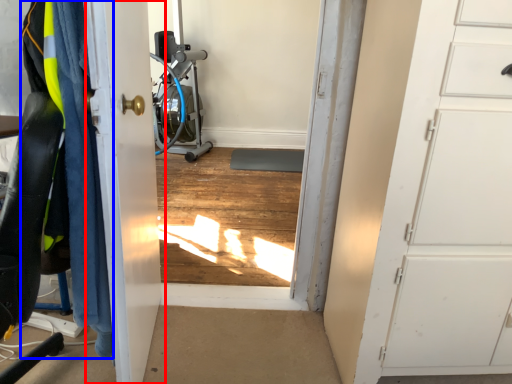
Question: Among these objects, which one is farthest to the camera, door (highlighted by a red box) or clothing (highlighted by a blue box)?

Choices:
 (A) door
 (B) clothing

Answer: (B)